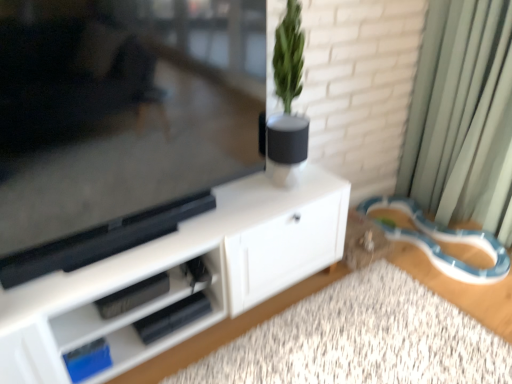
This screenshot has width=512, height=384. Identify the location of vacant area located to the right-hand side of white matte vase at center. (318, 182).